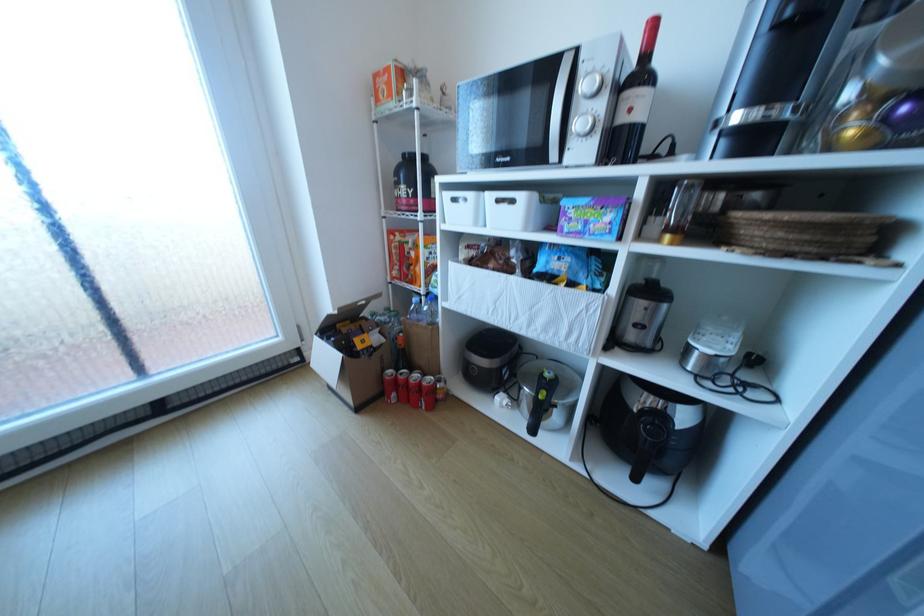
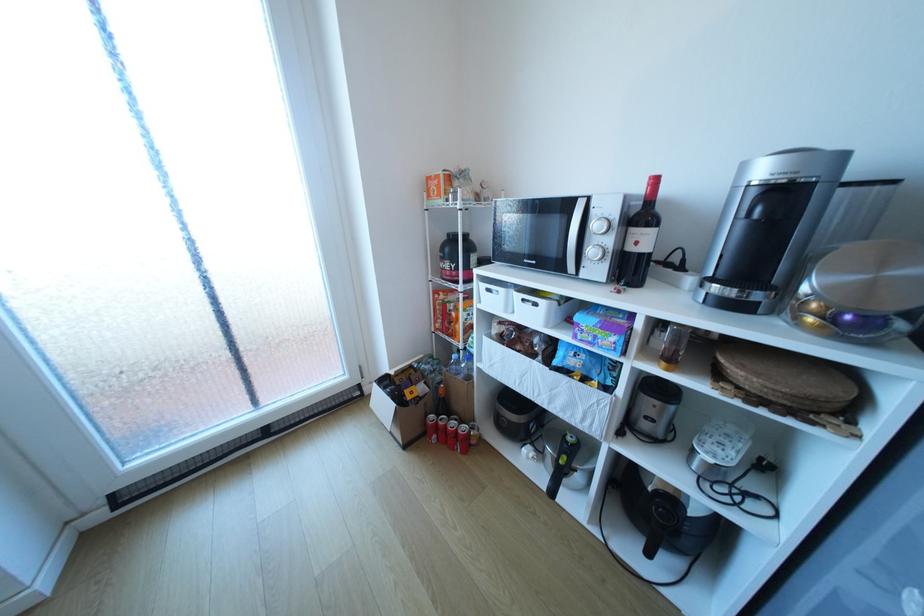
Question: The camera is either moving clockwise (left) or counter-clockwise (right) around the object. The first image is from the beginning of the video and the second image is from the end. Is the camera moving left or right when shooting the video?

Choices:
 (A) Left
 (B) Right

Answer: (B)